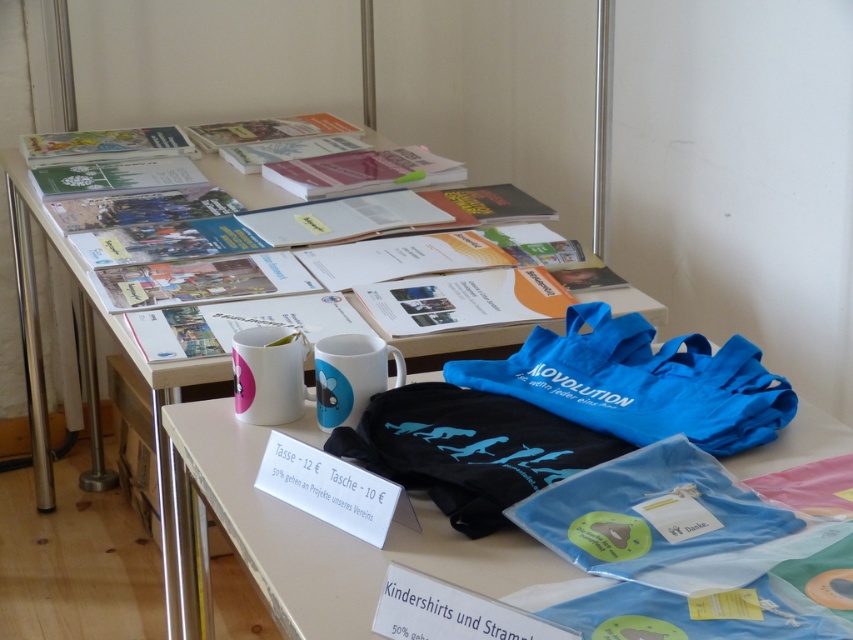
Between black fabric bag at center and white glossy mug at center, which one is positioned higher?

white glossy mug at center

What do you see at coordinates (468, 449) in the screenshot? This screenshot has height=640, width=853. I see `black fabric bag at center` at bounding box center [468, 449].

Find the location of `black fabric bag at center`. black fabric bag at center is located at coordinates (468, 449).

Find the location of a particular element. The width and height of the screenshot is (853, 640). black fabric bag at center is located at coordinates (468, 449).

Is point (793, 461) positioned in front of point (689, 396)?

Yes, point (793, 461) is closer to viewer.

Who is more distant from viewer, (451,541) or (643,419)?

The point (643,419) is behind.

Locate an element on the screen. blue fabric bag at lower center is located at coordinates (312, 529).

Does blue fabric bag at lower center have a larger size compared to white glossy mug at center?

Indeed, blue fabric bag at lower center has a larger size compared to white glossy mug at center.

Between point (230, 500) and point (357, 397), which one is positioned in front?

Point (230, 500) is in front.

At what (x,y) coordinates should I click in order to perform the action: click on blue fabric bag at lower center. Please return your answer as a coordinate pair (x, y). This screenshot has width=853, height=640. Looking at the image, I should click on (312, 529).